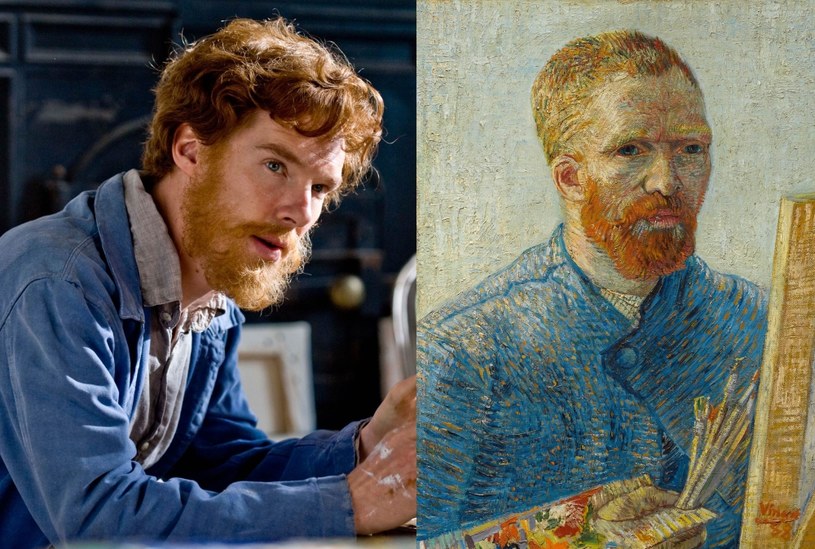
The width and height of the screenshot is (815, 549). I want to click on painting, so click(615, 363).